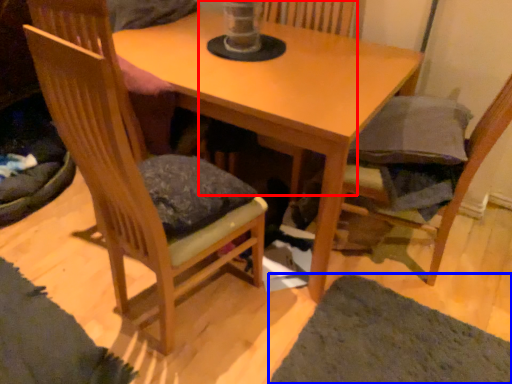
Question: Which object appears closest to the camera in this image, swivel chair (highlighted by a red box) or mat (highlighted by a blue box)?

Choices:
 (A) swivel chair
 (B) mat

Answer: (B)